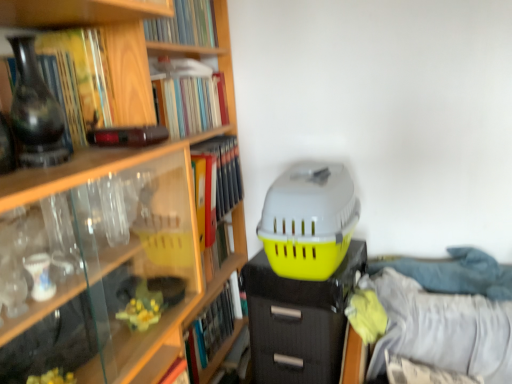
Question: Visually, is hardcover book at upper center, which is the 2th book from top to bottom, positioned to the left or to the right of matte black vase at left?

Choices:
 (A) right
 (B) left

Answer: (A)

Question: Is hardcover book at upper center, which is the 2th book from top to bottom, wider or thinner than matte black vase at left?

Choices:
 (A) thin
 (B) wide

Answer: (B)

Question: Which object is the closest to the matte black book at upper left, which is the 4th book from bottom to top?

Choices:
 (A) matte black vase at left
 (B) hardcover book at upper center, the 6th book positioned from the bottom
 (C) hardcover book at upper center, which is the 2th book from top to bottom
 (D) matte black file cabinet at center
 (E) wooden bookshelf at upper left, marked as the second book in a bottom-to-top arrangement

Answer: (A)

Question: Estimate the real-world distances between objects in this image. Which object is closer to the matte black file cabinet at center?

Choices:
 (A) wooden bookshelf at upper left, which is counted as the fifth book, starting from the top
 (B) matte black book at upper left, the 3th book from the top
 (C) hardcover book at lower left, which is the first book in bottom-to-top order
 (D) hardcover book at upper center, arranged as the 1th book when viewed from the top
 (E) yellow matte file folder at upper center, acting as the 3th book starting from the bottom

Answer: (C)